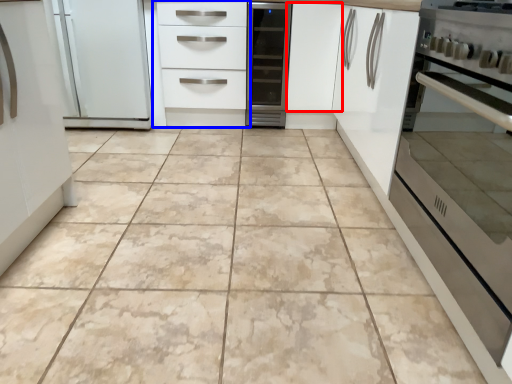
Question: Which object appears closest to the camera in this image, cabinetry (highlighted by a red box) or chest of drawers (highlighted by a blue box)?

Choices:
 (A) cabinetry
 (B) chest of drawers

Answer: (B)